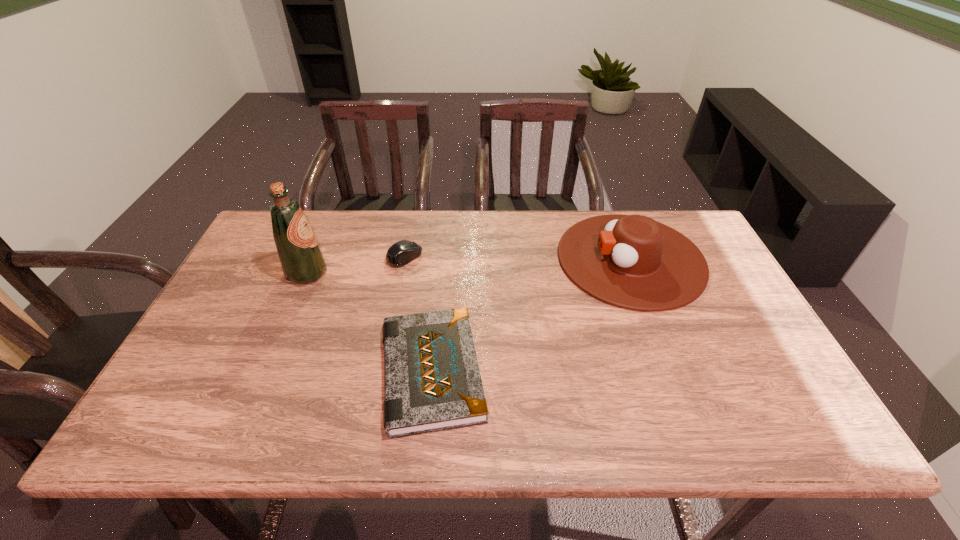
At what (x,y) coordinates should I click in order to perform the action: click on vacant space at the left edge. Please return your answer as a coordinate pair (x, y). The image size is (960, 540). Looking at the image, I should click on (240, 315).

Identify the location of vacant space at the right edge of the desktop. (771, 355).

Locate an element on the screen. This screenshot has height=540, width=960. free space between the leftmost object and the notebook is located at coordinates (370, 322).

Where is `vacant point located between the notebook and the second tallest object`? The image size is (960, 540). vacant point located between the notebook and the second tallest object is located at coordinates (531, 315).

Where is `vacant area between the nearest object and the cowboy hat`? The width and height of the screenshot is (960, 540). vacant area between the nearest object and the cowboy hat is located at coordinates (531, 315).

Find the location of a particular element. This screenshot has width=960, height=540. unoccupied position between the mouse and the tallest object is located at coordinates (356, 265).

I want to click on empty space that is in between the mouse and the rightmost object, so click(x=517, y=258).

Locate an element on the screen. The width and height of the screenshot is (960, 540). vacant area that lies between the cowboy hat and the leftmost object is located at coordinates (468, 266).

Image resolution: width=960 pixels, height=540 pixels. In order to click on vacant area that lies between the olive oil and the mouse in this screenshot , I will do `click(356, 265)`.

The height and width of the screenshot is (540, 960). Identify the location of empty space that is in between the mouse and the olive oil. (356, 265).